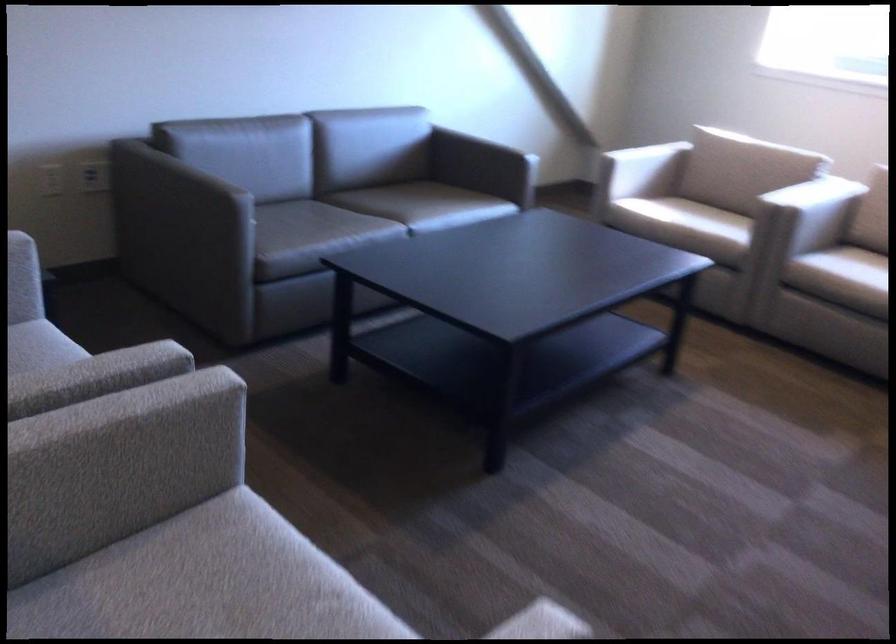
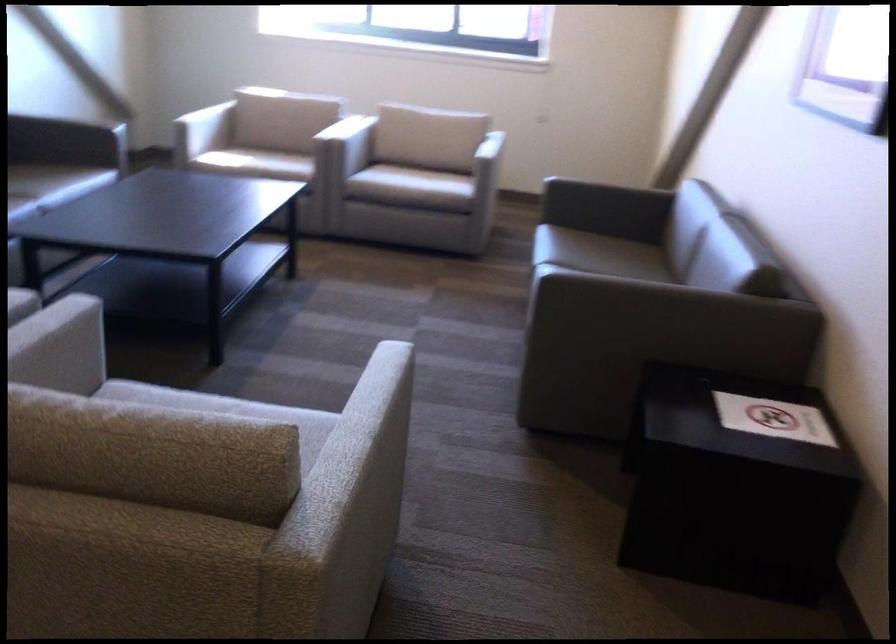
The point at (679, 232) is marked in the first image. Where is the corresponding point in the second image?

(255, 163)